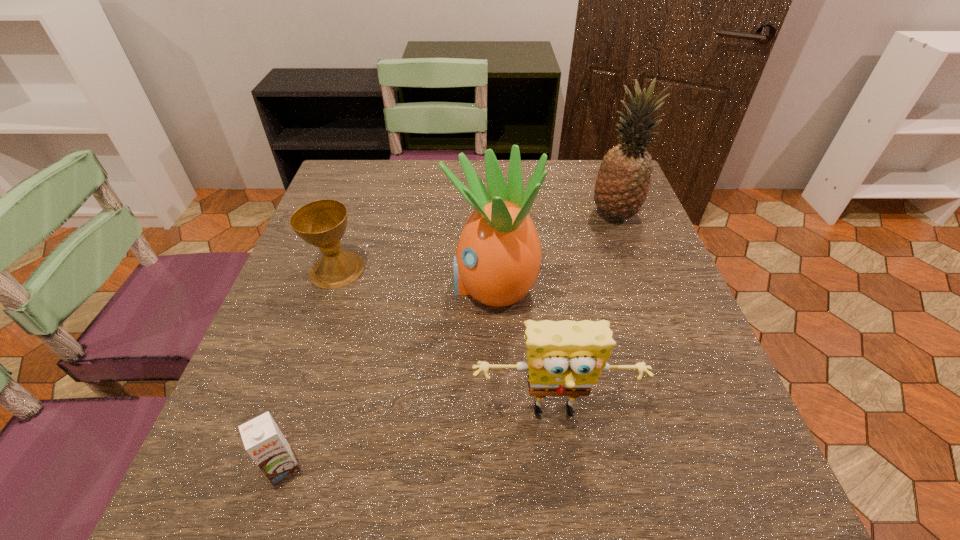
Find the location of `vacant region between the farther pineapple and the shortest object`. vacant region between the farther pineapple and the shortest object is located at coordinates (448, 341).

I want to click on unoccupied position between the nearer pineapple and the rightmost object, so click(553, 250).

Where is `vacant space that's between the nearest object and the chalice`? The image size is (960, 540). vacant space that's between the nearest object and the chalice is located at coordinates (310, 368).

Identify the location of vacant area that lies between the chocolate milk and the chalice. (310, 368).

This screenshot has height=540, width=960. What are the coordinates of `free spot between the chalice and the fourth farthest object` in the screenshot? It's located at (446, 342).

I want to click on free space between the third tallest object and the left pineapple, so click(x=524, y=350).

Find the location of a particular element. empty space that is in between the sponge and the second shortest object is located at coordinates (446, 342).

The width and height of the screenshot is (960, 540). Identify the location of object that ranks as the third closest to the sponge. (322, 223).

Identify which object is located as the nearest to the left pineapple. Please provide its 2D coordinates. Your answer should be formatted as a tuple, i.e. [(x, y)], where the tuple contains the x and y coordinates of a point satisfying the conditions above.

[(565, 358)]

I want to click on vacant point that satisfies the following two spatial constraints: 1. on the back side of the farther pineapple; 2. on the right side of the nearest object, so click(x=364, y=215).